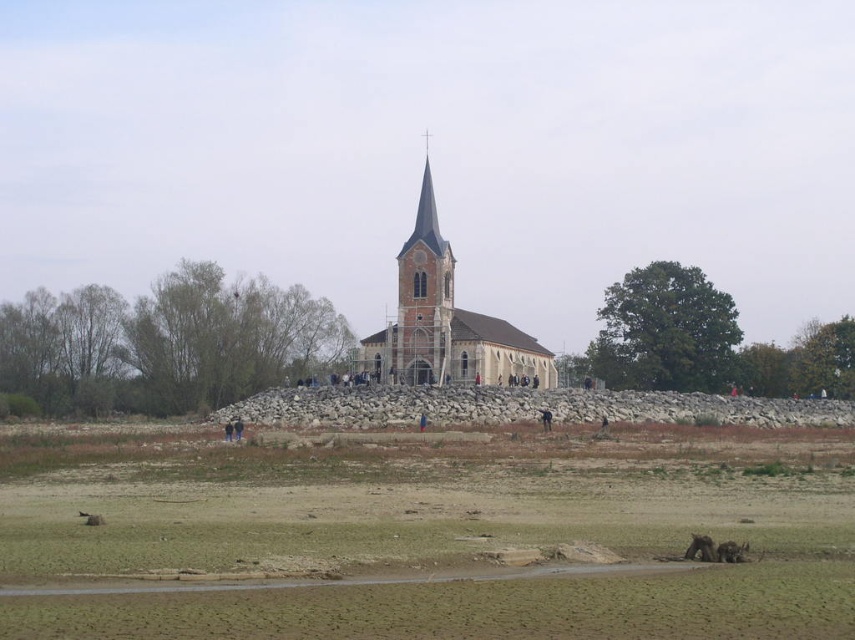
Based on the photo, is white brick church at center smaller than brown fuzzy dog at lower right?

Incorrect, white brick church at center is not smaller in size than brown fuzzy dog at lower right.

From the picture: Who is lower down, white brick church at center or brown fuzzy dog at lower right?

Positioned lower is brown fuzzy dog at lower right.

Is point (540, 376) positioned in front of point (746, 541)?

No, (540, 376) is further to viewer.

Where is `white brick church at center`? white brick church at center is located at coordinates (x=444, y=323).

Is point (505, 358) more distant than point (705, 536)?

Yes, it is.

Does white brick church at center have a greater height compared to brown furry dog at lower right?

Yes, white brick church at center is taller than brown furry dog at lower right.

This screenshot has height=640, width=855. Describe the element at coordinates (444, 323) in the screenshot. I see `white brick church at center` at that location.

The width and height of the screenshot is (855, 640). What are the coordinates of `white brick church at center` in the screenshot? It's located at (444, 323).

Which is more to the left, brown dry dirt field at lower center or brown furry dog at lower right?

From the viewer's perspective, brown dry dirt field at lower center appears more on the left side.

Does brown dry dirt field at lower center appear on the left side of brown furry dog at lower right?

Indeed, brown dry dirt field at lower center is positioned on the left side of brown furry dog at lower right.

What do you see at coordinates (447, 538) in the screenshot? Image resolution: width=855 pixels, height=640 pixels. I see `brown dry dirt field at lower center` at bounding box center [447, 538].

Find the location of a particular element. This screenshot has height=640, width=855. brown dry dirt field at lower center is located at coordinates (447, 538).